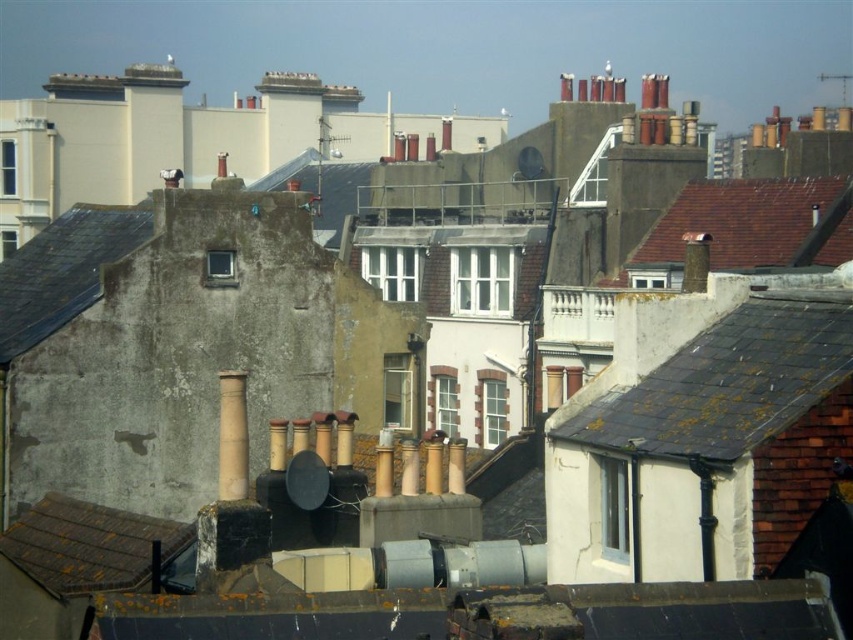
You are standing on the street looking up at the rooftops. Which roof, the gray slate roof at center or the brown tile roof at lower left, is closer to you?

The gray slate roof at center is closer to you because the brown tile roof at lower left is behind it.